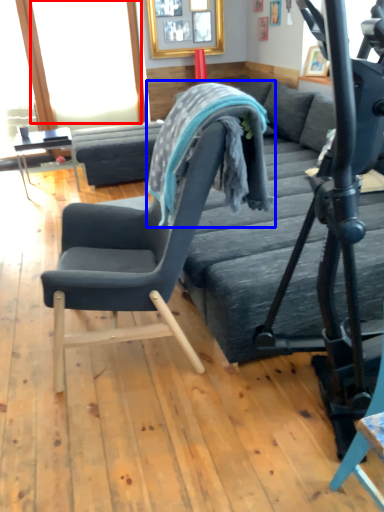
Question: Which object appears farthest to the camera in this image, window screen (highlighted by a red box) or bean bag chair (highlighted by a blue box)?

Choices:
 (A) window screen
 (B) bean bag chair

Answer: (A)